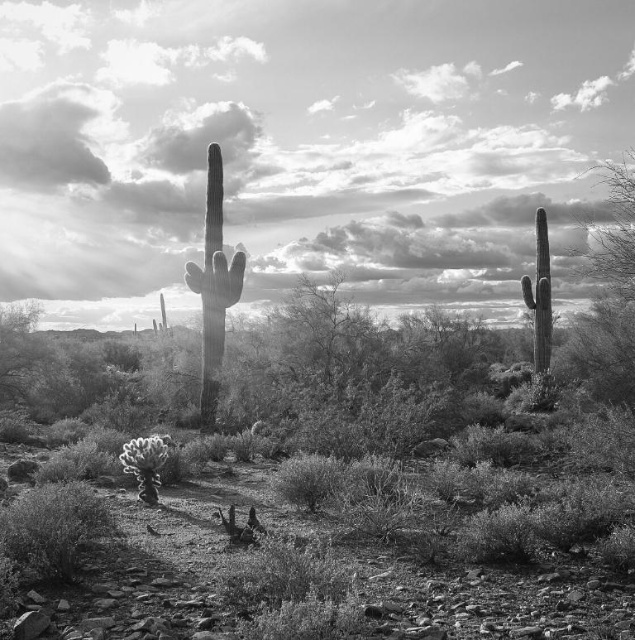
Can you confirm if smooth green cactus at center is shorter than smooth gray cactus at right?

Yes.

Does smooth green cactus at center appear over smooth gray cactus at right?

Yes, smooth green cactus at center is above smooth gray cactus at right.

At what (x,y) coordinates should I click in order to perform the action: click on smooth green cactus at center. Please return your answer as a coordinate pair (x, y). Looking at the image, I should click on (213, 285).

Looking at this image, is cloudy sky at upper center further to the viewer compared to smooth green cactus at center?

No, it is in front of smooth green cactus at center.

Can you confirm if cloudy sky at upper center is taller than smooth green cactus at center?

Correct, cloudy sky at upper center is much taller as smooth green cactus at center.

At what (x,y) coordinates should I click in order to perform the action: click on cloudy sky at upper center. Please return your answer as a coordinate pair (x, y). Image resolution: width=635 pixels, height=640 pixels. Looking at the image, I should click on (304, 147).

Is cloudy sky at upper center wider than smooth gray cactus at right?

Yes.

Which is below, cloudy sky at upper center or smooth gray cactus at right?

Positioned lower is smooth gray cactus at right.

What do you see at coordinates (304, 147) in the screenshot? I see `cloudy sky at upper center` at bounding box center [304, 147].

The height and width of the screenshot is (640, 635). What are the coordinates of `cloudy sky at upper center` in the screenshot? It's located at pyautogui.click(x=304, y=147).